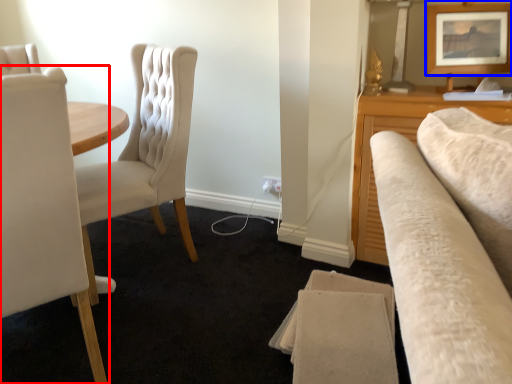
Question: Which point is further to the camera, chair (highlighted by a red box) or picture frame (highlighted by a blue box)?

Choices:
 (A) chair
 (B) picture frame

Answer: (B)